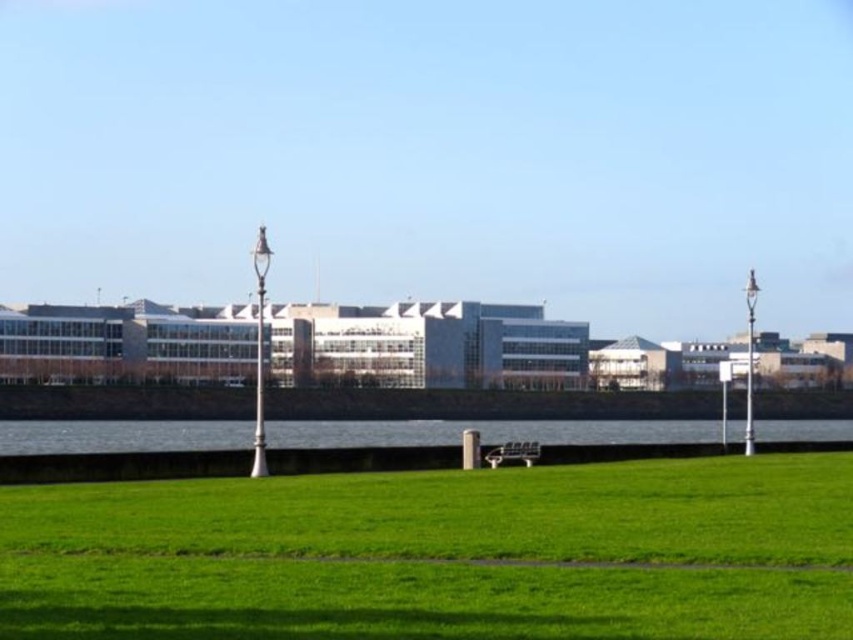
Who is positioned more to the right, green grassy field at lower center or wooden park bench at center?

Positioned to the right is wooden park bench at center.

Does green grassy field at lower center have a larger size compared to wooden park bench at center?

Indeed, green grassy field at lower center has a larger size compared to wooden park bench at center.

Between point (624, 589) and point (508, 449), which one is positioned behind?

The point (508, 449) is behind.

You are a GUI agent. You are given a task and a screenshot of the screen. Output one action in this format:
    pyautogui.click(x=<x>, y=<y>)
    Task: Click on the green grassy field at lower center
    
    Given the screenshot: What is the action you would take?
    pyautogui.click(x=439, y=554)

Does point (90, 520) lie in front of point (679, 435)?

Yes, it is.

Is green grassy field at lower center wider than blue glass water at center?

Incorrect, green grassy field at lower center's width does not surpass blue glass water at center's.

Locate an element on the screen. This screenshot has height=640, width=853. green grassy field at lower center is located at coordinates (439, 554).

In the scene shown: Between blue glass water at center and wooden park bench at center, which one appears on the right side from the viewer's perspective?

From the viewer's perspective, wooden park bench at center appears more on the right side.

Can you confirm if blue glass water at center is positioned above wooden park bench at center?

Actually, blue glass water at center is below wooden park bench at center.

Which is in front, point (94, 451) or point (496, 465)?

Point (496, 465) is more forward.

At what (x,y) coordinates should I click in order to perform the action: click on blue glass water at center. Please return your answer as a coordinate pair (x, y). The height and width of the screenshot is (640, 853). Looking at the image, I should click on (485, 433).